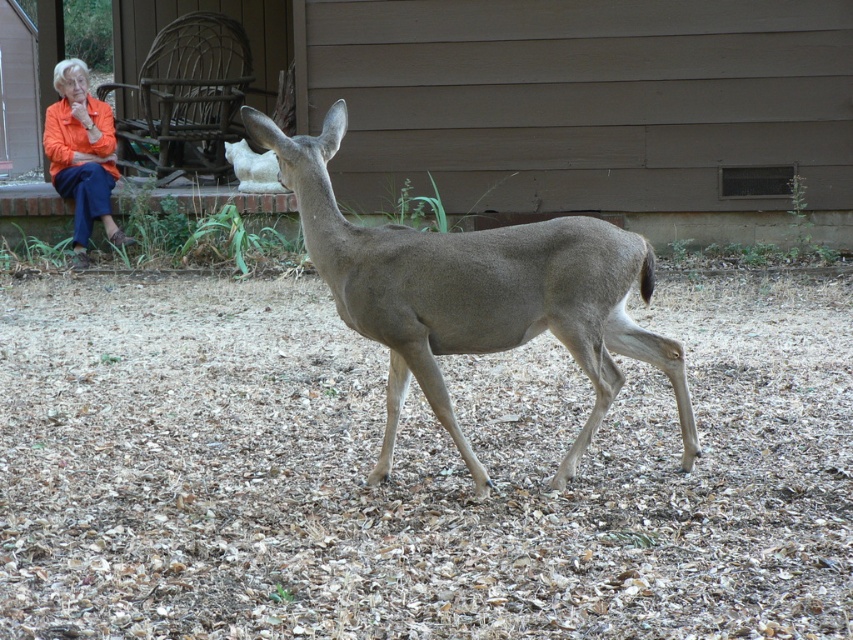
You are an observer in the scene and want to know which object is bigger between the gray matte deer at center and the orange fabric jacket at upper left. Can you determine this?

The gray matte deer at center is larger in size than the orange fabric jacket at upper left according to the description.

Consider the image. You are a photographer trying to capture the deer in the scene. You notice the orange fabric jacket at upper left and the white fur at center. Which object should you focus on first if you want to photograph the taller one?

The orange fabric jacket at upper left is taller than the white fur at center, so you should focus on the orange fabric jacket at upper left first.